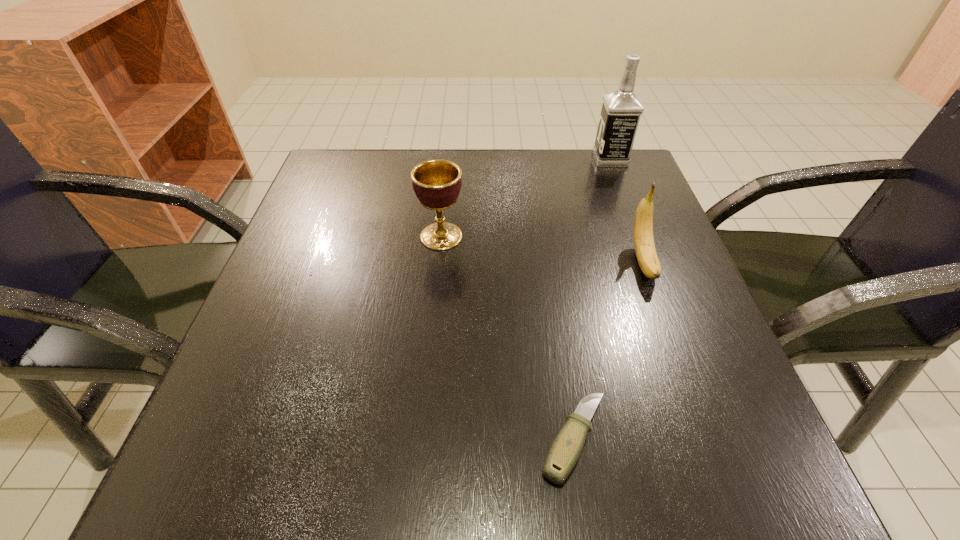
The image size is (960, 540). Identify the location of vacant space located at the start of the peel on the banana. (684, 369).

Identify the location of vacant area situated on the left of the nearest object. The height and width of the screenshot is (540, 960). (335, 440).

Find the location of a particular element. The height and width of the screenshot is (540, 960). object at the far edge is located at coordinates (621, 110).

This screenshot has height=540, width=960. I want to click on object positioned at the near edge, so click(565, 451).

Image resolution: width=960 pixels, height=540 pixels. Identify the location of vodka positioned at the right edge. (621, 110).

I want to click on banana at the right edge, so click(x=645, y=250).

Where is `object at the far right corner`? This screenshot has width=960, height=540. object at the far right corner is located at coordinates (621, 110).

Find the location of a particular element. This screenshot has width=960, height=540. vacant space at the far edge of the desktop is located at coordinates (474, 187).

Identify the location of free region at the left edge of the desktop. (332, 356).

Identify the location of vacant position at the right edge of the desktop. The height and width of the screenshot is (540, 960). (589, 212).